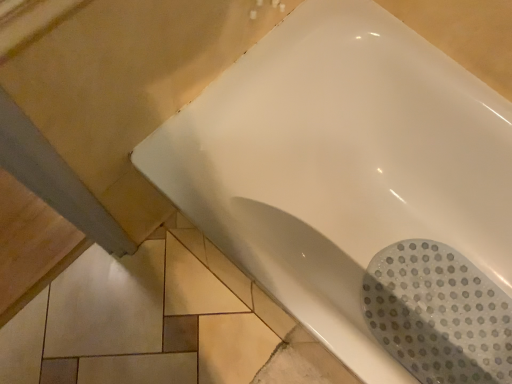
Describe the element at coordinates (341, 165) in the screenshot. I see `white glossy bathtub at center` at that location.

Where is `white glossy bathtub at center`? The width and height of the screenshot is (512, 384). white glossy bathtub at center is located at coordinates (341, 165).

This screenshot has width=512, height=384. I want to click on white glossy bathtub at center, so click(341, 165).